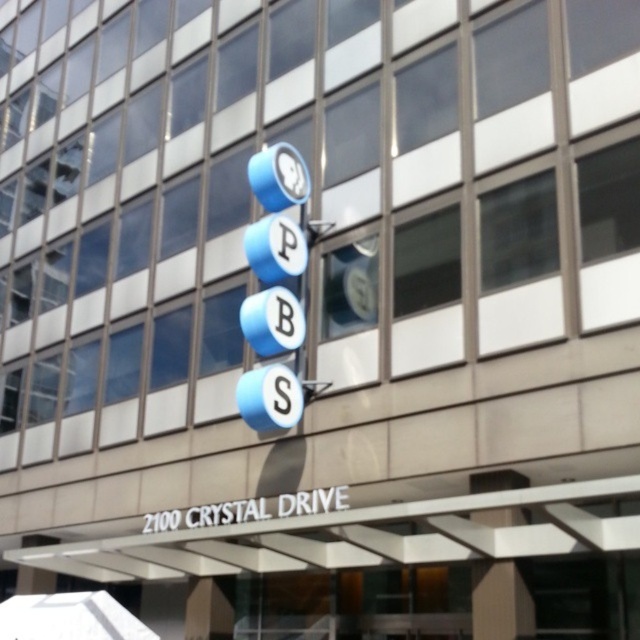
In the scene shown: You are standing in front of the modern building and notice two metallic blue clocks. The first is the blue metallic clock at upper center, and the second is the metallic blue clock at center. Which of these clocks is taller?

The blue metallic clock at upper center is taller than the metallic blue clock at center.

You are an architect inspecting the building facade. You notice two clocks on the building exterior. The first is the blue metallic clock at upper center and the second is the metallic blue clock at center. Which clock is bigger?

The blue metallic clock at upper center is larger than the metallic blue clock at center.

You are standing in front of the modern building and want to locate the two points marked on the facade. Which point, point [259,179] or point [289,180], is closer to your current position?

Point [259,179] is closer to the viewer than point [289,180].